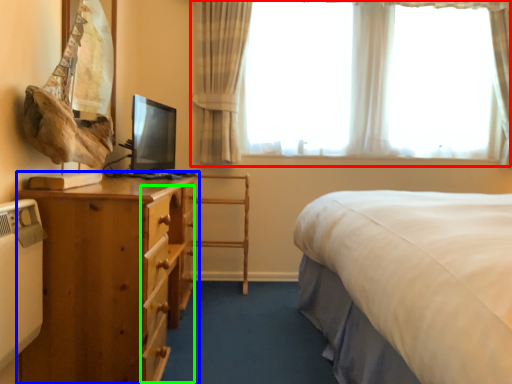
Question: Which object is positioned closest to window (highlighted by a red box)? Select from nightstand (highlighted by a blue box) and drawer (highlighted by a green box).

Choices:
 (A) nightstand
 (B) drawer

Answer: (B)